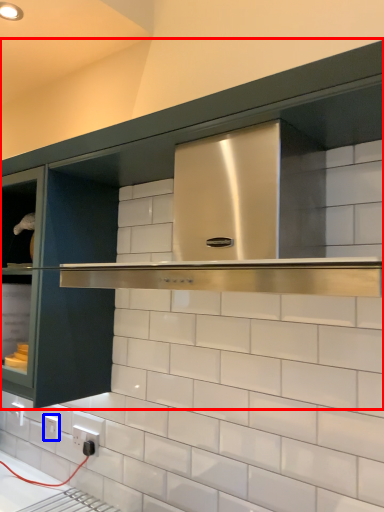
Question: Which object is closer to the camera taking this photo, cabinetry (highlighted by a red box) or electric outlet (highlighted by a blue box)?

Choices:
 (A) cabinetry
 (B) electric outlet

Answer: (A)